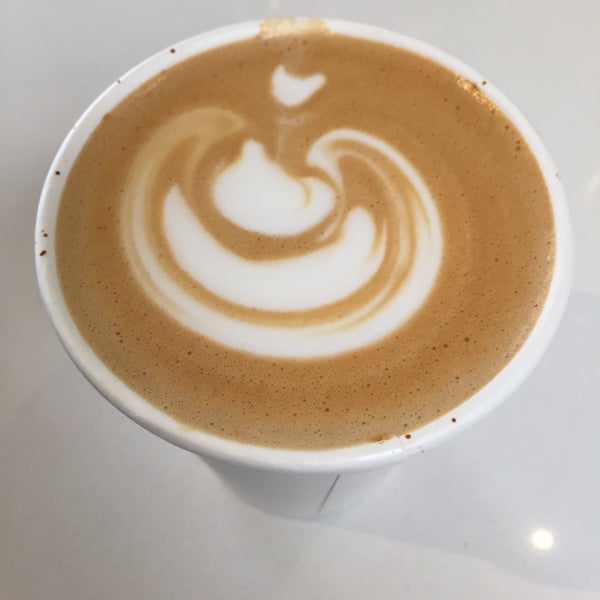
Image resolution: width=600 pixels, height=600 pixels. I want to click on diameter of cup circle top, so click(66, 224), click(120, 223), click(179, 223), click(256, 228), click(303, 228), click(362, 229), click(416, 227), click(476, 227), click(516, 228), click(536, 227).